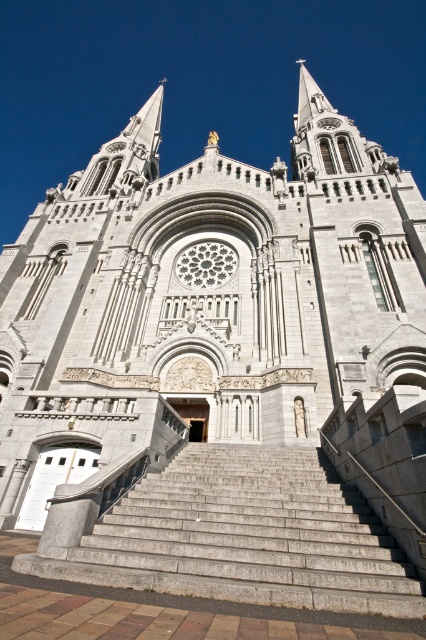
Can you confirm if gray stone church at center is positioned to the right of gray concrete stairs at center?

Yes, gray stone church at center is to the right of gray concrete stairs at center.

Who is shorter, gray stone church at center or gray concrete stairs at center?

Standing shorter between the two is gray concrete stairs at center.

Looking at this image, measure the distance between gray stone church at center and camera.

The distance of gray stone church at center from camera is 107.14 feet.

The width and height of the screenshot is (426, 640). What are the coordinates of `gray stone church at center` in the screenshot? It's located at (204, 300).